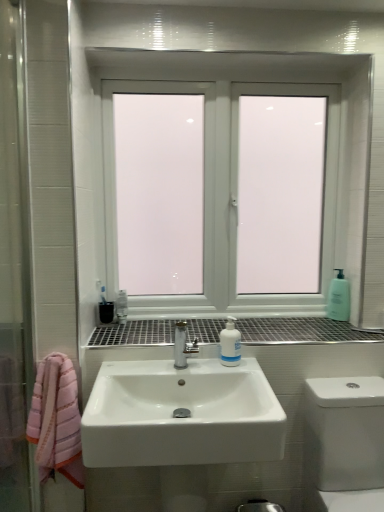
This screenshot has width=384, height=512. I want to click on free space above metallic grid at center (from a real-world perspective), so click(x=253, y=326).